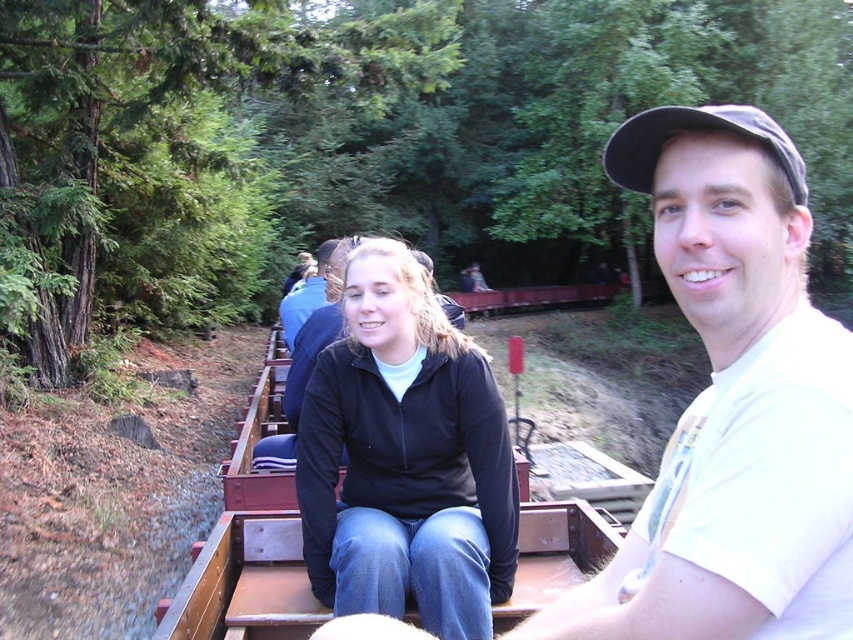
You are a photographer standing near the train tracks and want to take a photo of both the black matte jacket at center and the black fabric cap at upper right. Which object should you focus on first if you want to capture them both clearly in the same frame?

The black matte jacket at center is located below the black fabric cap at upper right, so you should focus on the black fabric cap at upper right first to ensure both are in focus since it is higher up in the frame.

You are standing at the point marked as point [732,404]. What object is located at this point?

The point [732,404] marks the white cotton shirt at center.

You are a photographer standing on the train platform and want to take a photo of both the black matte jacket at center and the black fabric cap at upper right. Which object should you focus on first to ensure both are in clear view?

You should focus on the black matte jacket at center first because it is closer to you than the black fabric cap at upper right, ensuring both are in focus as you adjust the camera.